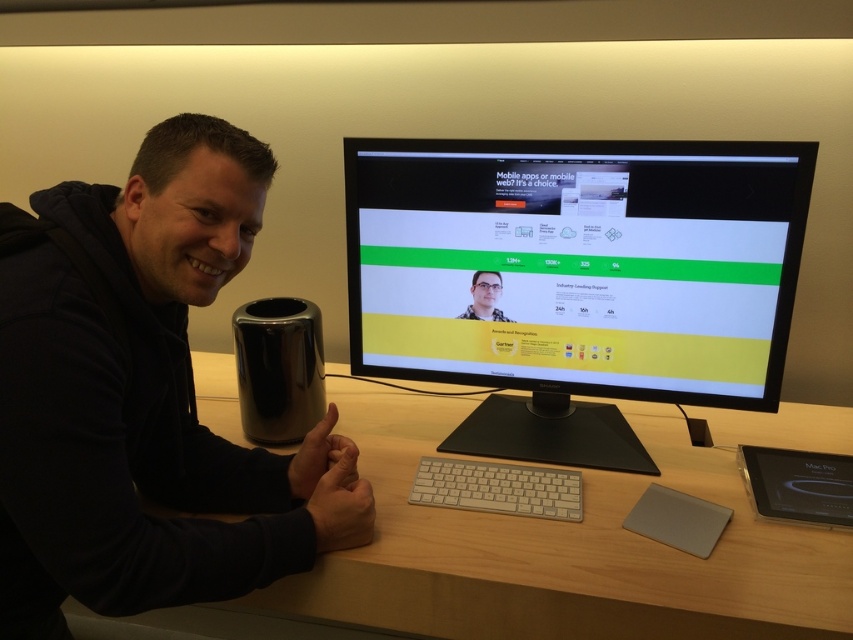
Where is `glossy black mug at center`? The image size is (853, 640). glossy black mug at center is located at coordinates (277, 369).

In the scene shown: Who is more distant from viewer, (262,365) or (480,288)?

The point (262,365) is more distant.

Image resolution: width=853 pixels, height=640 pixels. Describe the element at coordinates (277, 369) in the screenshot. I see `glossy black mug at center` at that location.

Image resolution: width=853 pixels, height=640 pixels. Find the location of `glossy black mug at center`. glossy black mug at center is located at coordinates (277, 369).

Can you confirm if black glossy monitor at center is smaller than white matte keyboard at center?

Incorrect, black glossy monitor at center is not smaller in size than white matte keyboard at center.

This screenshot has height=640, width=853. Identify the location of black glossy monitor at center. (576, 280).

Is point (61, 524) positioned behind point (477, 275)?

No, (61, 524) is in front of (477, 275).

Is black matte speaker at left bigger than matte black monitor at center?

Yes, black matte speaker at left is bigger than matte black monitor at center.

Which is in front, point (160, 376) or point (473, 305)?

Positioned in front is point (160, 376).

In order to click on black matte speaker at left in this screenshot , I will do `click(143, 397)`.